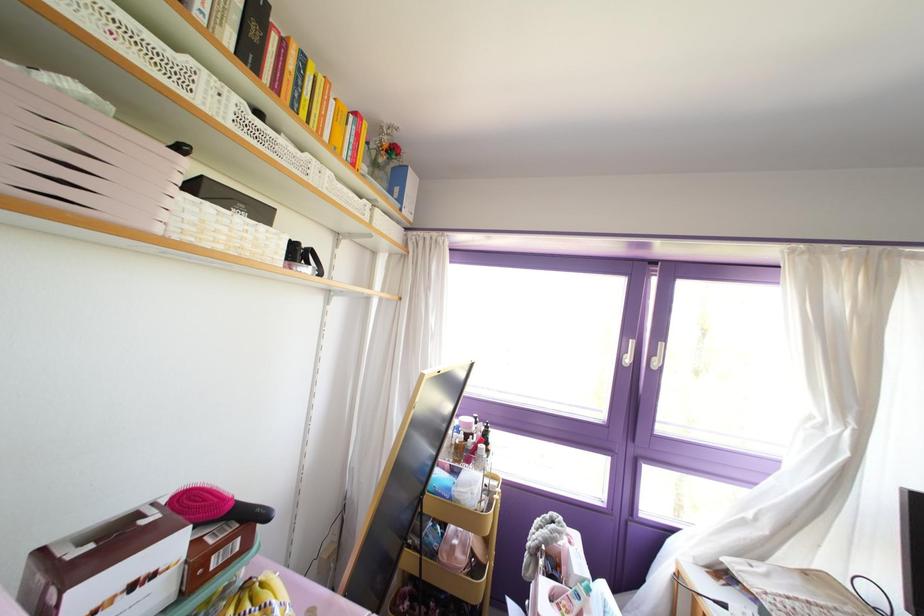
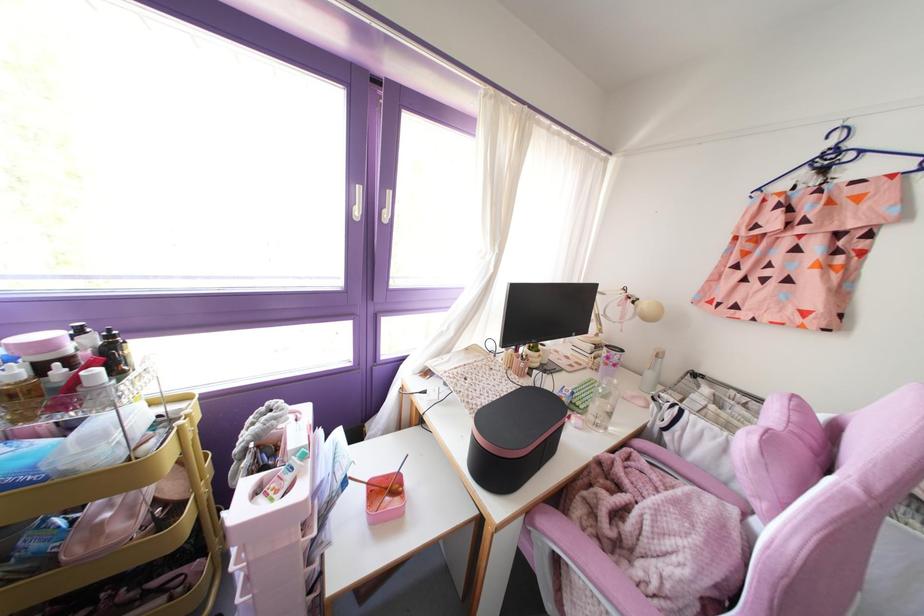
First-person continuous shooting, in which direction is the camera rotating?

The rotation direction of the camera is right-down.